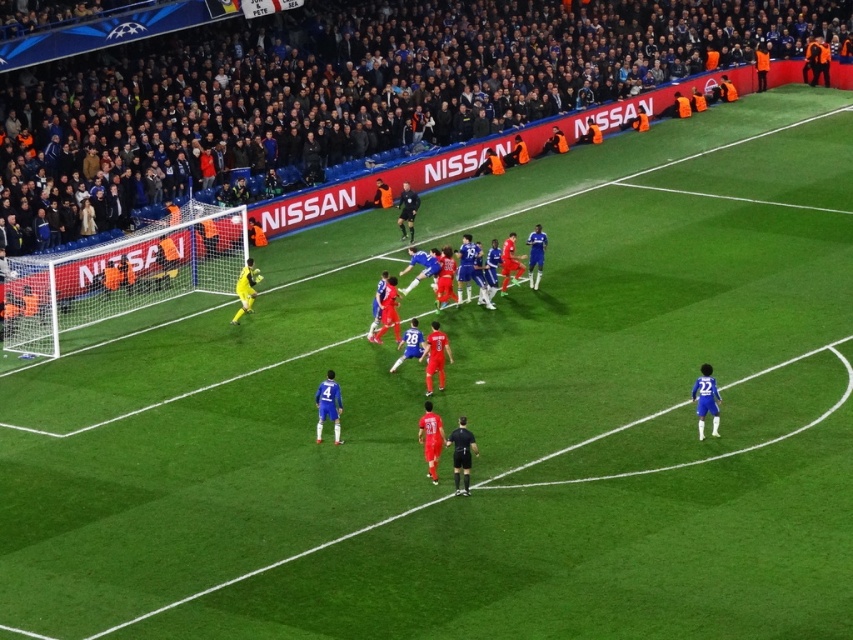
Question: From the image, what is the correct spatial relationship of white mesh net at left in relation to blue matte jersey at center?

Choices:
 (A) left
 (B) right

Answer: (A)

Question: Which of the following is the farthest from the observer?

Choices:
 (A) white mesh net at left
 (B) blue matte jersey at center
 (C) dark blue fabric crowd at upper center

Answer: (C)

Question: Among these points, which one is farthest from the camera?

Choices:
 (A) (32, 326)
 (B) (480, 298)

Answer: (B)

Question: From the image, what is the correct spatial relationship of white mesh net at left in relation to blue matte jersey at center?

Choices:
 (A) right
 (B) left

Answer: (B)

Question: Which object is the closest to the white mesh net at left?

Choices:
 (A) dark blue fabric crowd at upper center
 (B) blue matte jersey at center

Answer: (B)

Question: Does white mesh net at left have a lesser width compared to blue matte jersey at center?

Choices:
 (A) no
 (B) yes

Answer: (B)